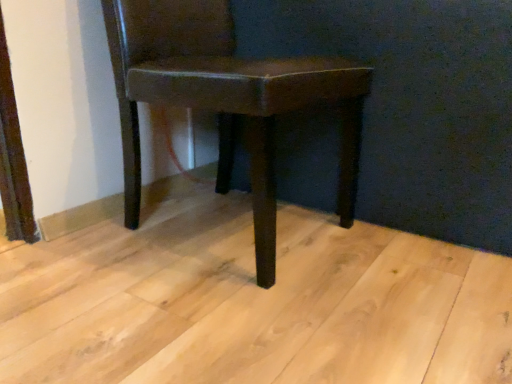
You are a GUI agent. You are given a task and a screenshot of the screen. Output one action in this format:
    pyautogui.click(x=<x>, y=<y>)
    Task: Click on the free location to the right of matte brown leather chair at center
    The image size is (512, 384).
    Given the screenshot: What is the action you would take?
    pyautogui.click(x=409, y=262)